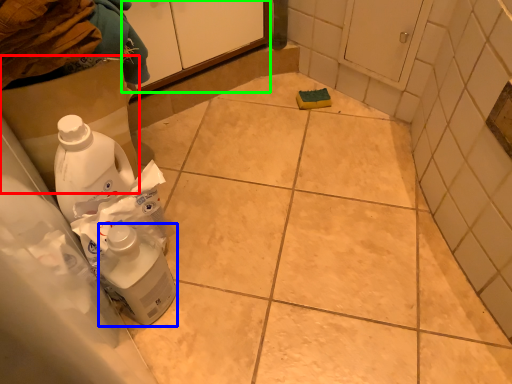
Question: Which is farther away from cardboard box (highlighted by a red box)? cleaning product (highlighted by a blue box) or cabinetry (highlighted by a green box)?

Choices:
 (A) cleaning product
 (B) cabinetry

Answer: (B)